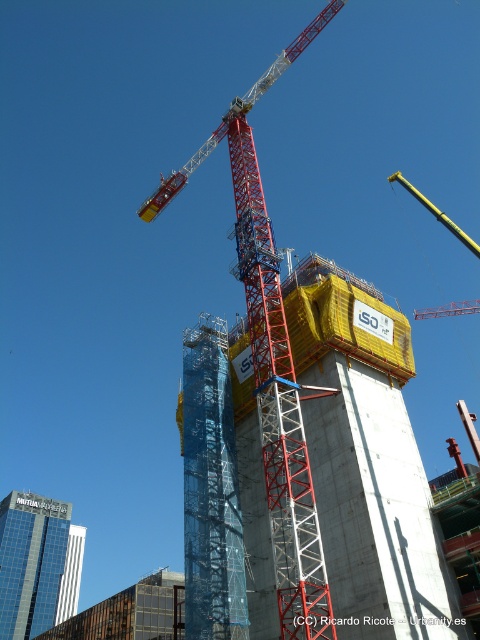
Is red metal crane at center bigger than blue mesh scaffolding at center?

Correct, red metal crane at center is larger in size than blue mesh scaffolding at center.

What do you see at coordinates (273, 365) in the screenshot?
I see `red metal crane at center` at bounding box center [273, 365].

Identify the location of red metal crane at center. (273, 365).

Is point (24, 620) positioned before point (455, 310)?

Yes, point (24, 620) is closer to viewer.

Does glass skyscraper at center have a lesser height compared to yellow metallic crane at upper center?

Yes, glass skyscraper at center is shorter than yellow metallic crane at upper center.

Does point (4, 554) come in front of point (468, 305)?

Yes, point (4, 554) is closer to viewer.

The image size is (480, 640). Identify the location of glass skyscraper at center. (31, 561).

Is glass skyscraper at center to the left of white glass tower at center from the viewer's perspective?

Correct, you'll find glass skyscraper at center to the left of white glass tower at center.

Between point (6, 500) and point (72, 556), which one is positioned behind?

Point (72, 556)

This screenshot has width=480, height=640. I want to click on glass skyscraper at center, so click(x=31, y=561).